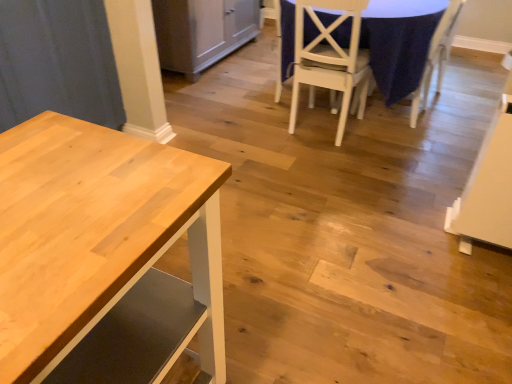
Question: Considering the relative sizes of blue fabric tablecloth at center and white fabric chair at upper right, acting as the 2th chair starting from the left, in the image provided, is blue fabric tablecloth at center taller than white fabric chair at upper right, acting as the 2th chair starting from the left,?

Choices:
 (A) no
 (B) yes

Answer: (B)

Question: From a real-world perspective, does blue fabric tablecloth at center sit lower than white fabric chair at upper right, acting as the 2th chair starting from the left?

Choices:
 (A) no
 (B) yes

Answer: (A)

Question: Is blue fabric tablecloth at center further to camera compared to white fabric chair at upper right, acting as the 2th chair starting from the left?

Choices:
 (A) yes
 (B) no

Answer: (B)

Question: From the image's perspective, is blue fabric tablecloth at center over white fabric chair at upper right, the 1th chair in the right-to-left sequence?

Choices:
 (A) yes
 (B) no

Answer: (A)

Question: From the image's perspective, is blue fabric tablecloth at center beneath white fabric chair at upper right, the 1th chair in the right-to-left sequence?

Choices:
 (A) yes
 (B) no

Answer: (B)

Question: From the image's perspective, relative to white matte chair at center, the 2th chair viewed from the right, is blue fabric tablecloth at center above or below?

Choices:
 (A) above
 (B) below

Answer: (A)

Question: Is blue fabric tablecloth at center to the left or to the right of white matte chair at center, the 2th chair viewed from the right, in the image?

Choices:
 (A) left
 (B) right

Answer: (B)

Question: In terms of height, does blue fabric tablecloth at center look taller or shorter compared to white matte chair at center, the 1th chair from the left?

Choices:
 (A) tall
 (B) short

Answer: (B)

Question: Is blue fabric tablecloth at center wider or thinner than white matte chair at center, the 1th chair from the left?

Choices:
 (A) wide
 (B) thin

Answer: (A)

Question: Would you say matte gray cabinet at center is to the left or to the right of blue fabric tablecloth at center in the picture?

Choices:
 (A) left
 (B) right

Answer: (A)

Question: Based on their sizes in the image, would you say matte gray cabinet at center is bigger or smaller than blue fabric tablecloth at center?

Choices:
 (A) small
 (B) big

Answer: (A)

Question: Which is correct: matte gray cabinet at center is inside blue fabric tablecloth at center, or outside of it?

Choices:
 (A) outside
 (B) inside

Answer: (A)

Question: In terms of height, does matte gray cabinet at center look taller or shorter compared to blue fabric tablecloth at center?

Choices:
 (A) tall
 (B) short

Answer: (B)

Question: In terms of width, does white matte chair at center, the 2th chair viewed from the right, look wider or thinner when compared to matte gray cabinet at center?

Choices:
 (A) thin
 (B) wide

Answer: (B)

Question: From a real-world perspective, is white matte chair at center, the 1th chair from the left, physically located above or below matte gray cabinet at center?

Choices:
 (A) below
 (B) above

Answer: (B)